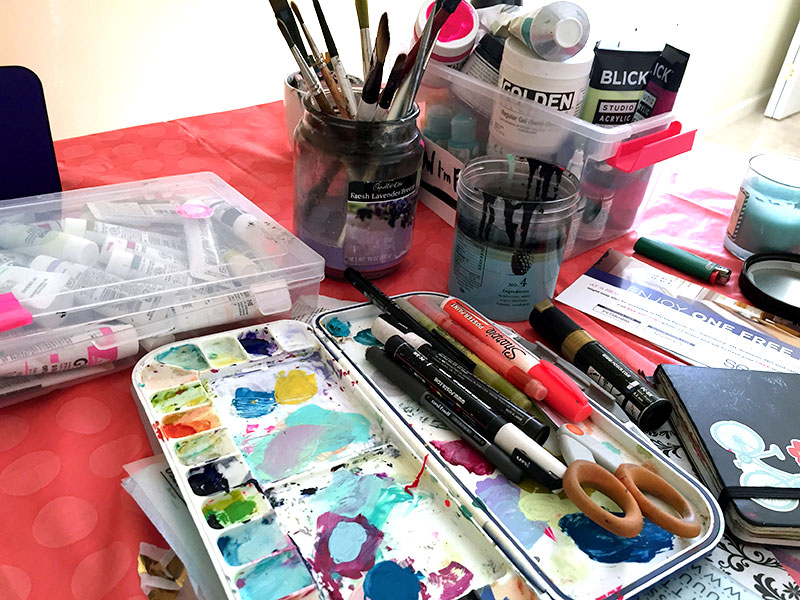
This screenshot has width=800, height=600. Find the location of `jar of used paintbrushes`. jar of used paintbrushes is located at coordinates (366, 114).